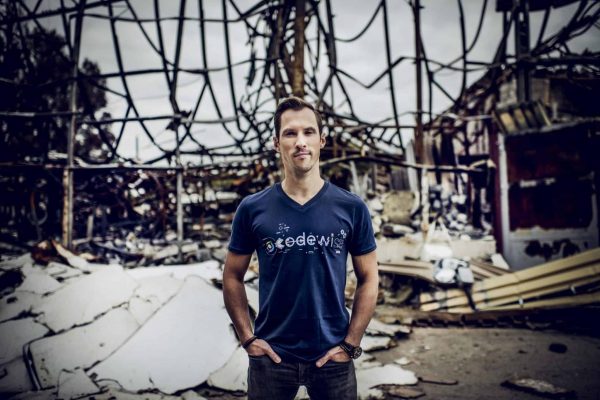
At what (x,y) coordinates should I click in order to perform the action: click on drywall. Please return your answer as a coordinate pair (x, y). The height and width of the screenshot is (400, 600). Looking at the image, I should click on tap(176, 349).